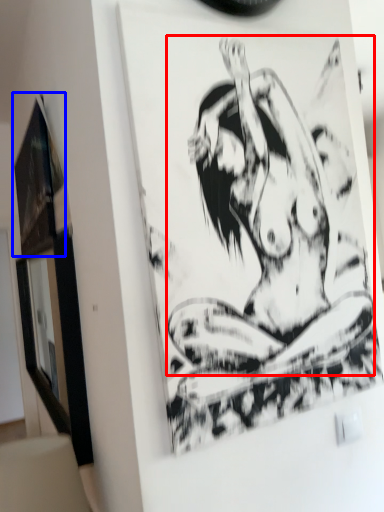
Question: Which object appears farthest to the camera in this image, person (highlighted by a red box) or picture frame (highlighted by a blue box)?

Choices:
 (A) person
 (B) picture frame

Answer: (B)